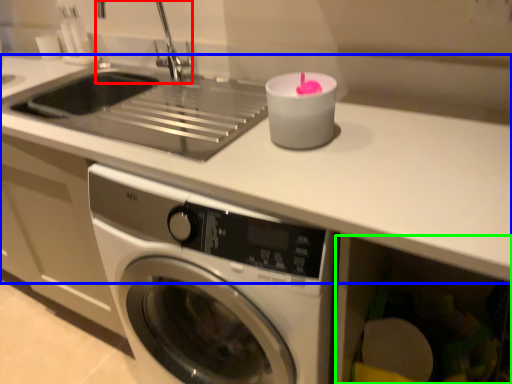
Question: Based on their relative distances, which object is farther from faucet (highlighted by a red box)? Choose from counter top (highlighted by a blue box) and drawer (highlighted by a green box).

Choices:
 (A) counter top
 (B) drawer

Answer: (B)